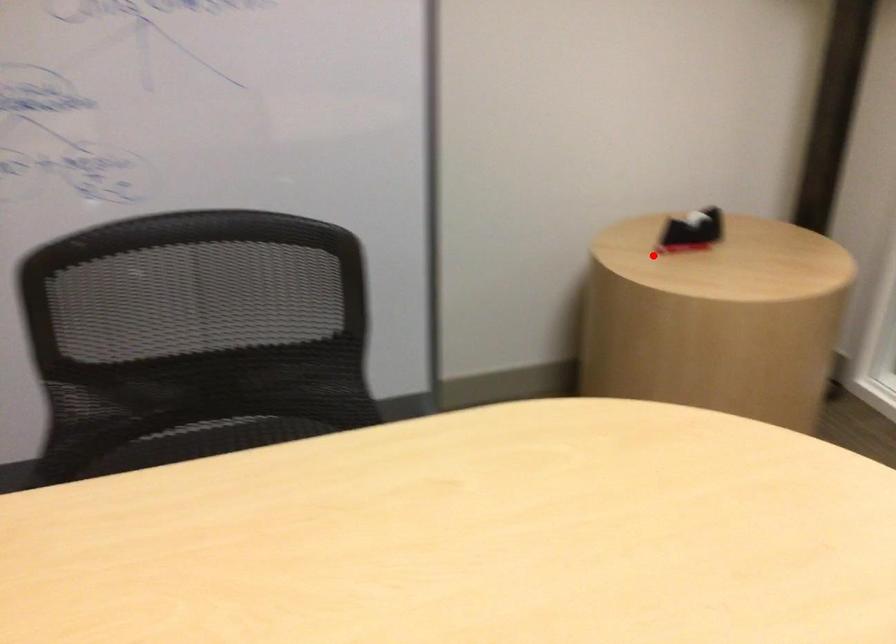
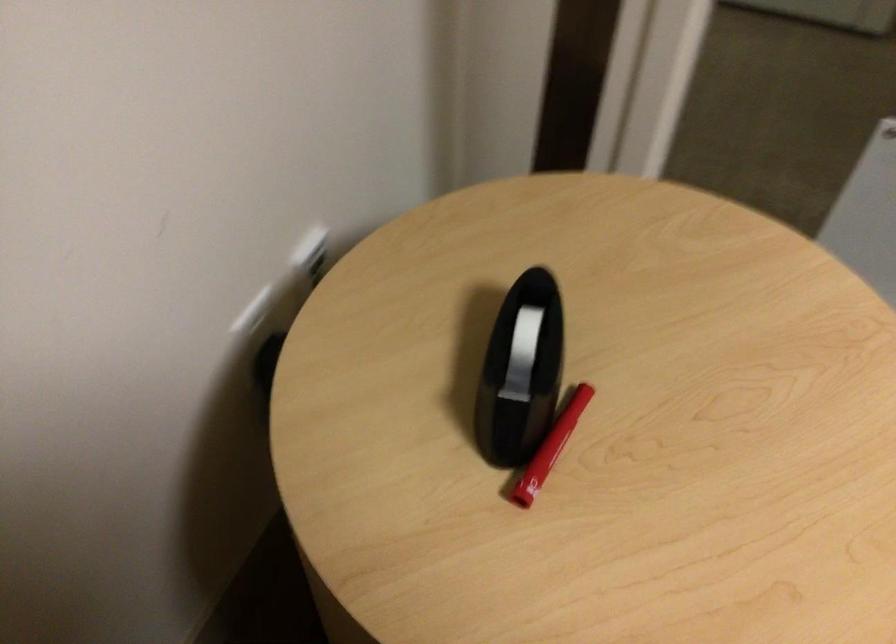
Locate, in the second image, the point that corresponds to the highlighted location in the first image.

(527, 511)